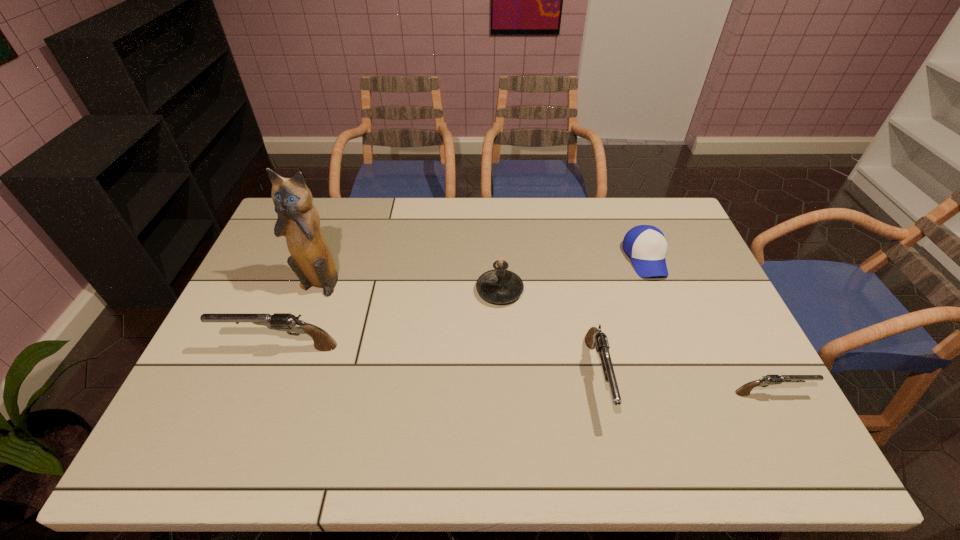
Where is `vacant position at the near edge of the desktop`? This screenshot has height=540, width=960. vacant position at the near edge of the desktop is located at coordinates (366, 386).

The width and height of the screenshot is (960, 540). In the image, there is a desktop. Find the location of `vacant space at the left edge`. vacant space at the left edge is located at coordinates (266, 308).

Find the location of a particular element. This screenshot has height=540, width=960. vacant space at the right edge is located at coordinates (717, 318).

The width and height of the screenshot is (960, 540). In the image, there is a desktop. Identify the location of vacant space at the far left corner. coord(273,239).

Identify the location of free spot at the near right corner of the desktop. click(x=733, y=387).

Locate an element on the screen. free space between the candle and the shortest object is located at coordinates (636, 342).

Where is `free space between the candle and the fourth object from left to right`? The width and height of the screenshot is (960, 540). free space between the candle and the fourth object from left to right is located at coordinates (549, 333).

The width and height of the screenshot is (960, 540). What are the coordinates of `free space between the third object from left to right and the leftmost gun` in the screenshot? It's located at pyautogui.click(x=390, y=319).

Find the location of a particular element. free space that is in between the second gun from right to left and the leftmost gun is located at coordinates (439, 361).

Image resolution: width=960 pixels, height=540 pixels. In order to click on vacant area that lies between the leftmost gun and the second shortest object in this screenshot , I will do `click(463, 302)`.